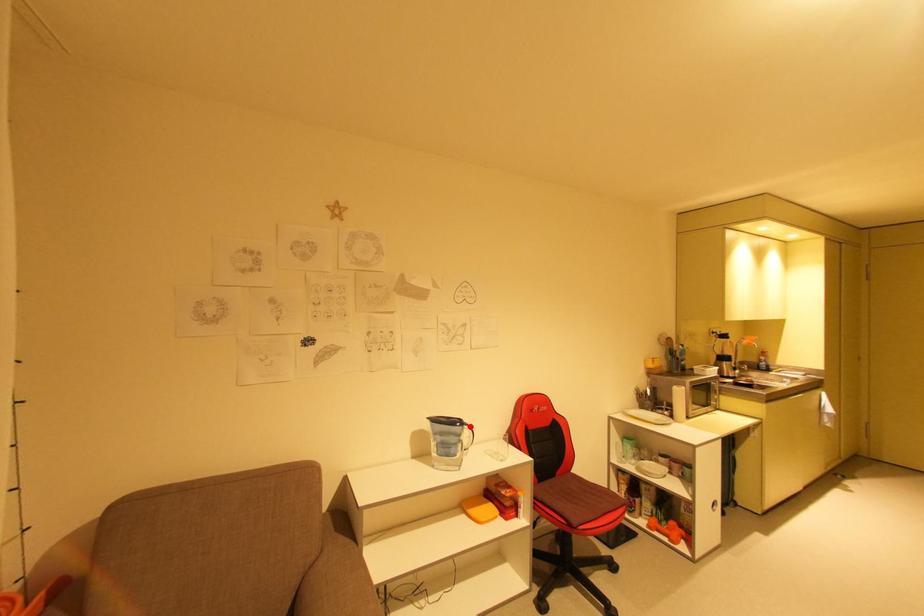
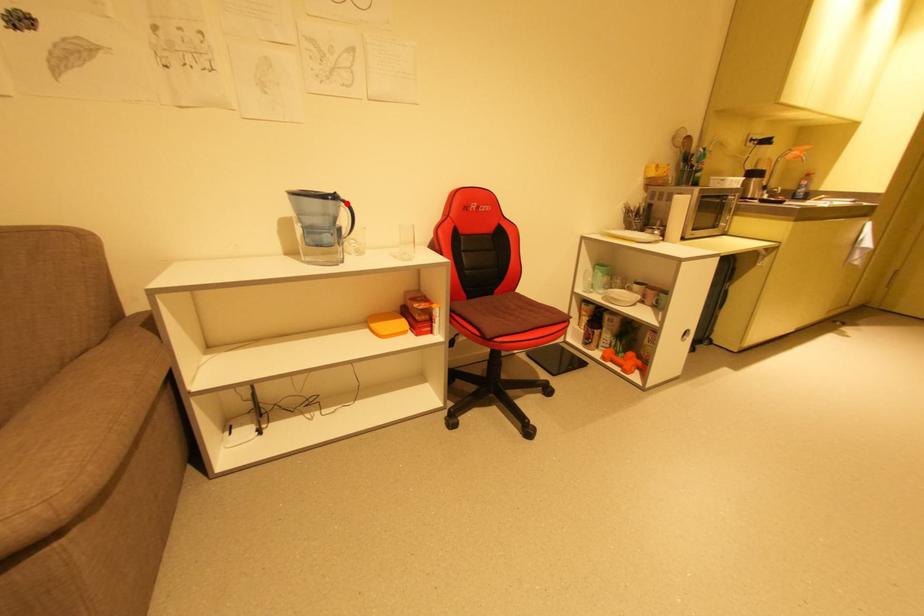
From the picture: I am providing you with two images of the same scene from different viewpoints. A red point is marked on the first image and another point is marked on the second image. Is the marked point in image1 the same physical position as the marked point in image2?

Yes